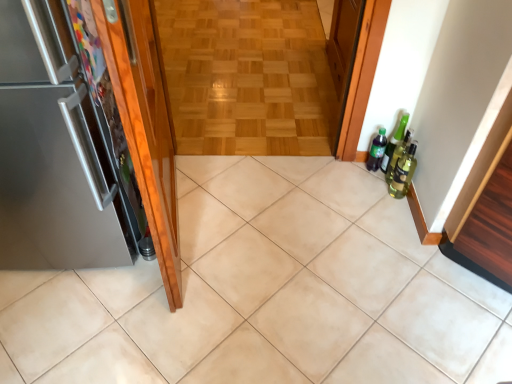
Image resolution: width=512 pixels, height=384 pixels. Find the location of `vacant space to the right of satin metallic refrigerator at left, which is the 2th door in right-to-left order`. vacant space to the right of satin metallic refrigerator at left, which is the 2th door in right-to-left order is located at coordinates (221, 240).